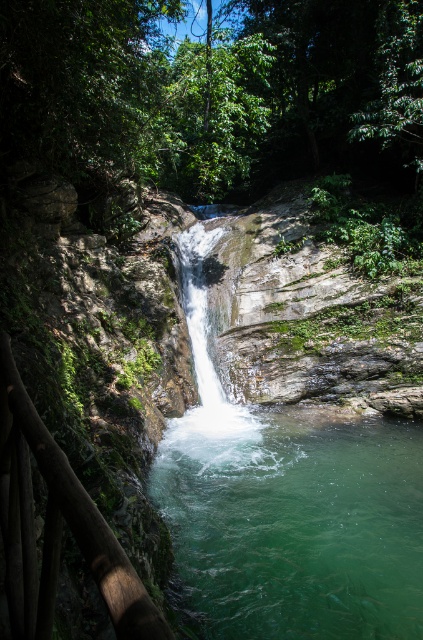
You are standing at the edge of the pool and want to cross to the other side. The green translucent water at center and clear water at center are in your path. Which body of water should you avoid stepping into to ensure your safety?

You should avoid stepping into the green translucent water at center because it is shorter than the clear water at center, meaning it might be shallower and less safe for crossing.

You are standing at the edge of the pool and want to cross to the other side. The green translucent water at center and clear water at center are in your path. Which part of the water should you step on first to reach the other side?

You should step on the green translucent water at center first because it is closer to the viewer than the clear water at center, making it the first part of the water you encounter on your path.

You are standing at the edge of the waterfall and see a point marked at coordinates point (293, 524). According to the scene description, where is this point located?

The point (293, 524) is on the green translucent water at center.